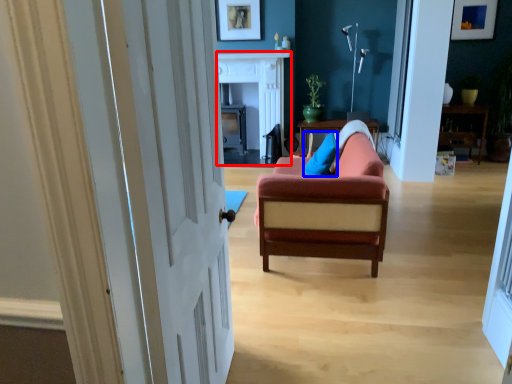
Question: Which point is further to the camera, fireplace (highlighted by a red box) or pillow (highlighted by a blue box)?

Choices:
 (A) fireplace
 (B) pillow

Answer: (A)